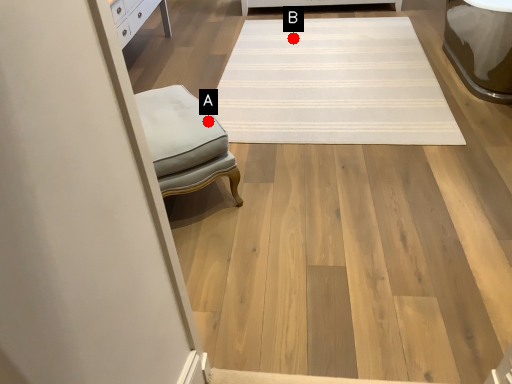
Question: Two points are circled on the image, labeled by A and B beside each circle. Which point is farther to the camera?

Choices:
 (A) A is further
 (B) B is further

Answer: (B)